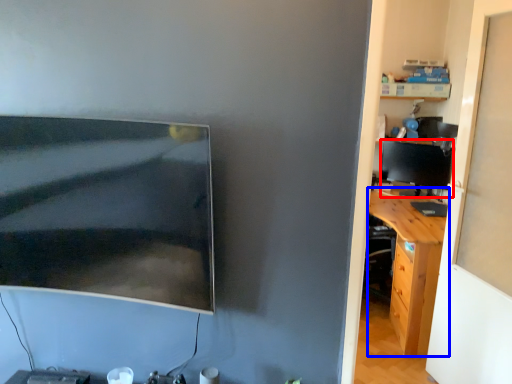
Question: Among these objects, which one is farthest to the camera, computer monitor (highlighted by a red box) or desk (highlighted by a blue box)?

Choices:
 (A) computer monitor
 (B) desk

Answer: (A)